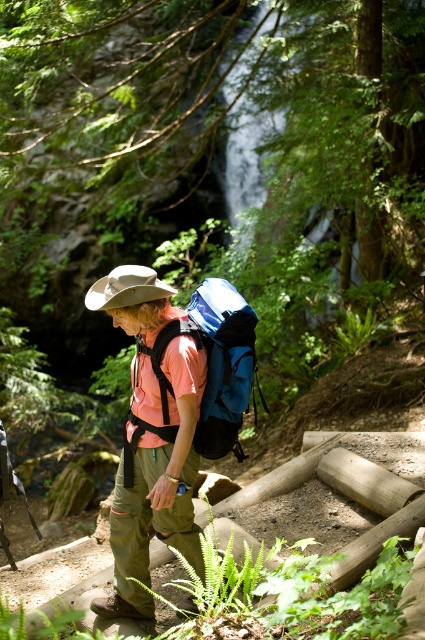
You are a photographer trying to capture the hiker in the scene. You want to ensure both the matte pink shirt at center and the blue fabric backpack at center are clearly visible in your shot. Given their sizes, which object should you focus on first to ensure proper framing?

The matte pink shirt at center has a lesser width compared to the blue fabric backpack at center, so you should focus on the blue fabric backpack at center first to ensure it fits within the frame properly.

You are a hiker who wants to pack your gear efficiently. You have a blue fabric backpack at center and a tan fabric hat at center. Which item can hold more items based on their size?

The blue fabric backpack at center is larger in size than the tan fabric hat at center, so it can hold more items.

You are standing at the camera position and want to reach the point marked at coordinates (149, 460). The path is clear, but you have a 3.5 meter long ladder that you can carry. Can you reach the point without needing to place the ladder down?

The distance between you and the point marked at coordinates (149, 460) is 4.69 meters. Since your ladder is only 3.5 meters long, you cannot reach the point without placing the ladder down because the distance exceeds the ladder length.